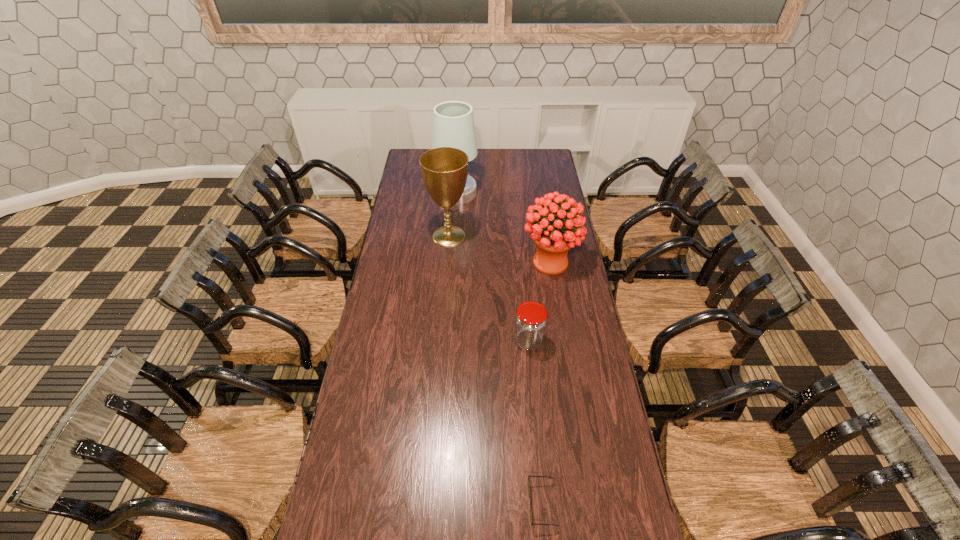
Locate an element on the screen. The height and width of the screenshot is (540, 960). blank region between the bouquet and the lampshade is located at coordinates (503, 227).

Where is `unoccupied position between the jar and the lampshade`? This screenshot has width=960, height=540. unoccupied position between the jar and the lampshade is located at coordinates (492, 267).

Image resolution: width=960 pixels, height=540 pixels. I want to click on vacant area that lies between the bouquet and the nearest object, so click(x=546, y=383).

The width and height of the screenshot is (960, 540). In order to click on vacant region between the farthest object and the jar in this screenshot , I will do `click(492, 267)`.

Locate an element on the screen. The height and width of the screenshot is (540, 960). free spot between the shortest object and the second nearest object is located at coordinates (536, 422).

The width and height of the screenshot is (960, 540). What are the coordinates of `vacant area that lies between the second shortest object and the farthest object` in the screenshot? It's located at tap(492, 267).

I want to click on vacant area between the lampshade and the bouquet, so click(x=503, y=227).

Locate an element on the screen. Image resolution: width=960 pixels, height=540 pixels. free space between the nearest object and the second nearest object is located at coordinates (536, 422).

Identify the location of unoccupied position between the farthest object and the fourth tallest object. The width and height of the screenshot is (960, 540). pos(492,267).

The image size is (960, 540). What are the coordinates of `object that can be found as the third closest to the bouquet` in the screenshot? It's located at (453, 124).